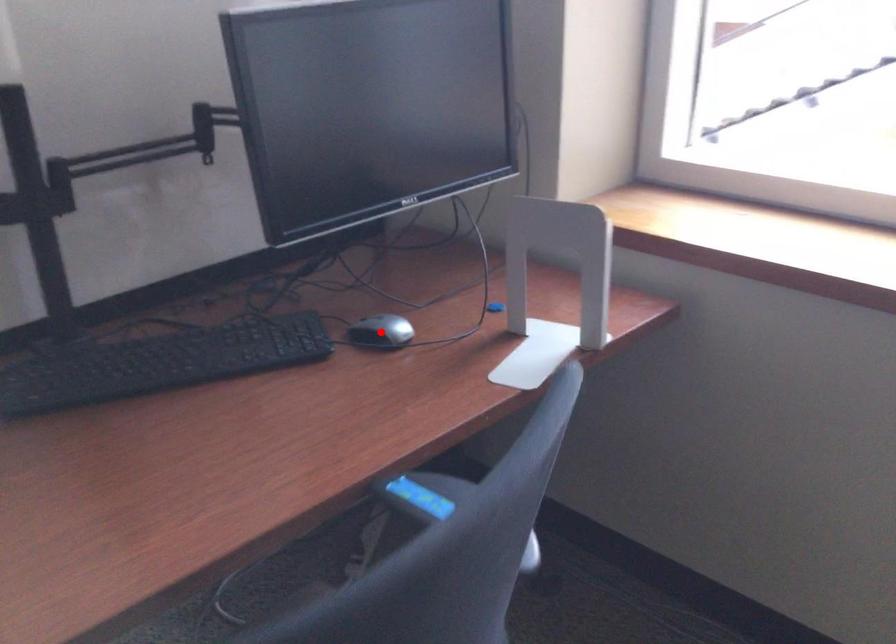
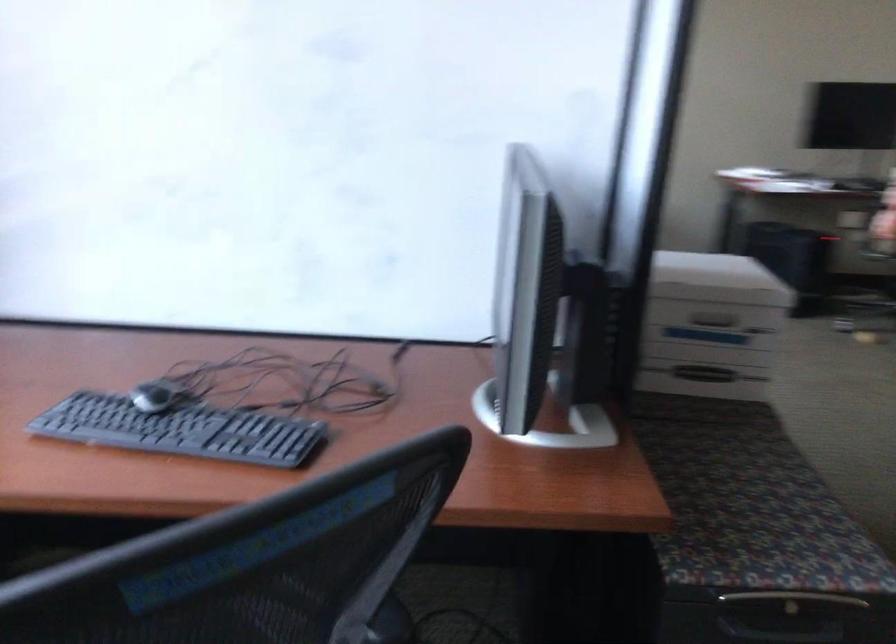
Question: I am providing you with two images of the same scene from different viewpoints. A red point is marked on the first image. At the location where the point appears in image 1, is it still visible in image 2?

Choices:
 (A) Yes
 (B) No

Answer: (B)